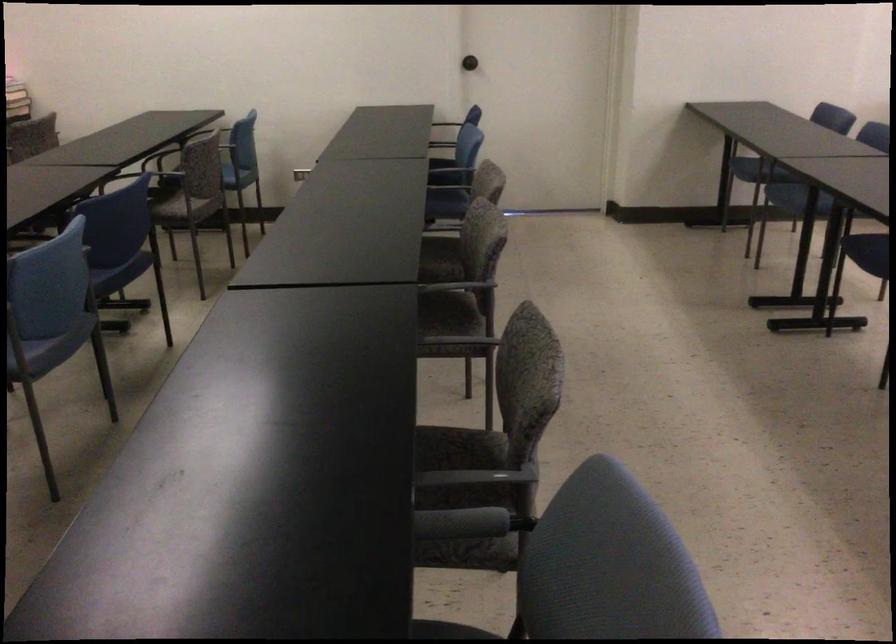
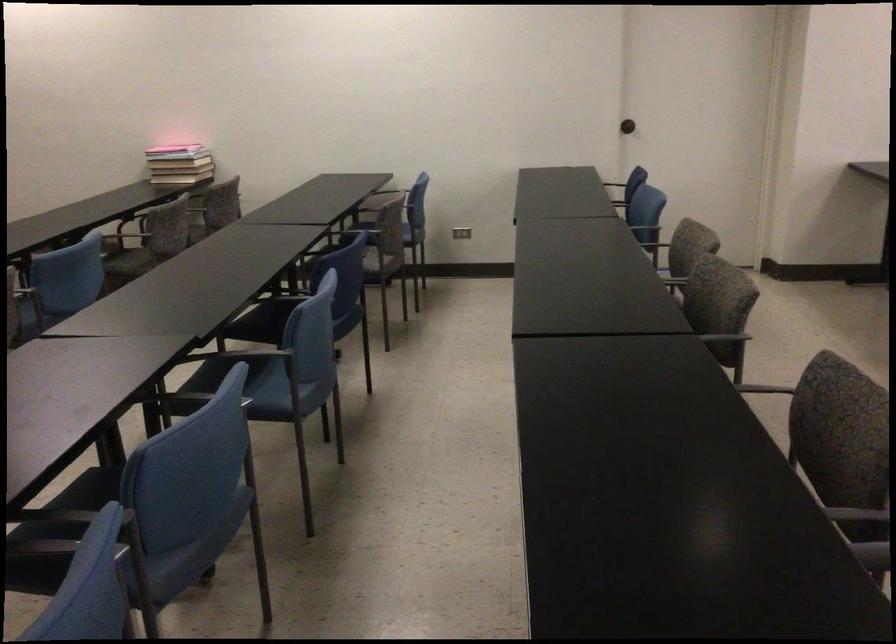
Find the pixel in the second image that matches point 468,290 in the first image.

(725, 337)